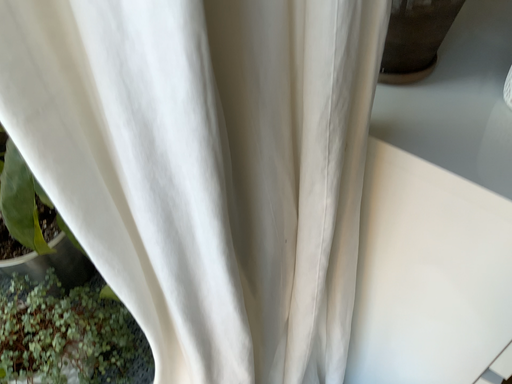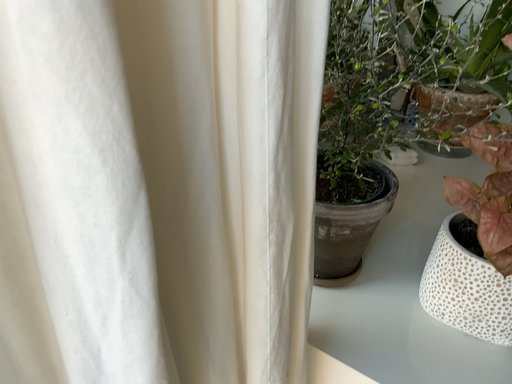
Question: How did the camera likely rotate when shooting the video?

Choices:
 (A) rotated upward
 (B) rotated downward

Answer: (A)